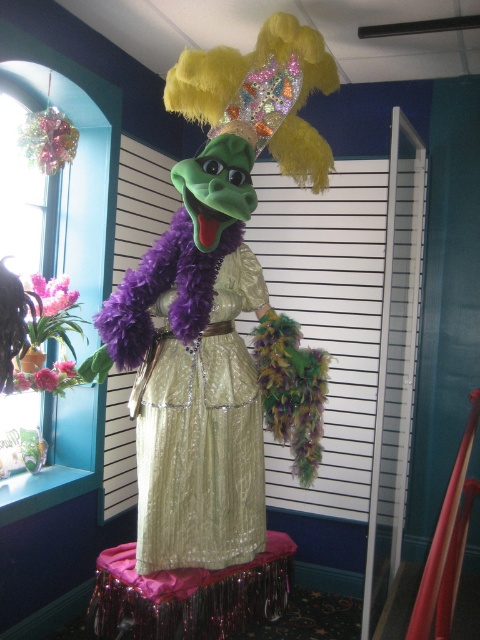
Can you confirm if shiny gold dress at center is smaller than purple sequined skirt at center?

Actually, shiny gold dress at center might be larger than purple sequined skirt at center.

The image size is (480, 640). What do you see at coordinates (213, 300) in the screenshot? I see `shiny gold dress at center` at bounding box center [213, 300].

The width and height of the screenshot is (480, 640). I want to click on shiny gold dress at center, so pos(213,300).

Locate an element on the screen. shiny gold dress at center is located at coordinates (213, 300).

Is gold sequined dress at center thinner than purple sequined skirt at center?

Yes, gold sequined dress at center is thinner than purple sequined skirt at center.

Which is in front, point (153, 554) or point (267, 531)?

Point (153, 554) is in front.

The height and width of the screenshot is (640, 480). I want to click on gold sequined dress at center, so click(x=202, y=436).

Can you confirm if shiny gold dress at center is positioned above gold sequined dress at center?

Indeed, shiny gold dress at center is positioned over gold sequined dress at center.

Find the location of `shiny gold dress at center`. shiny gold dress at center is located at coordinates (213, 300).

At what (x,y) coordinates should I click in order to perform the action: click on shiny gold dress at center. Please return your answer as a coordinate pair (x, y). The height and width of the screenshot is (640, 480). Looking at the image, I should click on (x=213, y=300).